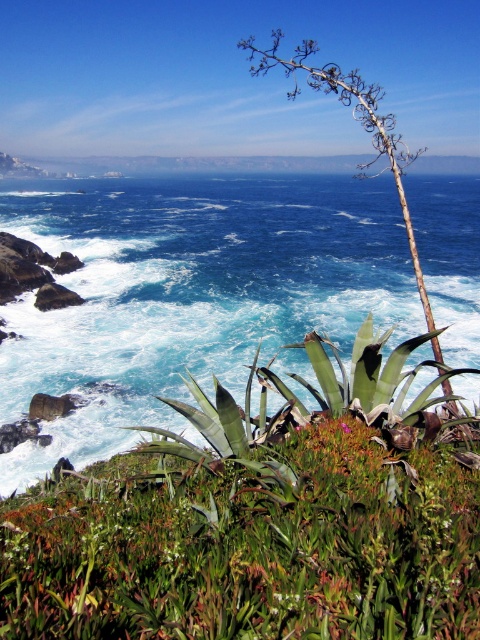
Question: Which point appears closest to the camera in this image?

Choices:
 (A) [x=322, y=620]
 (B) [x=310, y=179]

Answer: (A)

Question: Which object is closer to the camera taking this photo?

Choices:
 (A) green leafy plant at center
 (B) blue liquid water at center

Answer: (A)

Question: Can you confirm if green leafy plant at center is wider than blue liquid water at center?

Choices:
 (A) no
 (B) yes

Answer: (A)

Question: Does green leafy plant at center appear over blue liquid water at center?

Choices:
 (A) no
 (B) yes

Answer: (A)

Question: Which point appears closest to the camera in this image?

Choices:
 (A) (39, 540)
 (B) (17, 224)

Answer: (A)

Question: Is green leafy plant at center below blue liquid water at center?

Choices:
 (A) yes
 (B) no

Answer: (A)